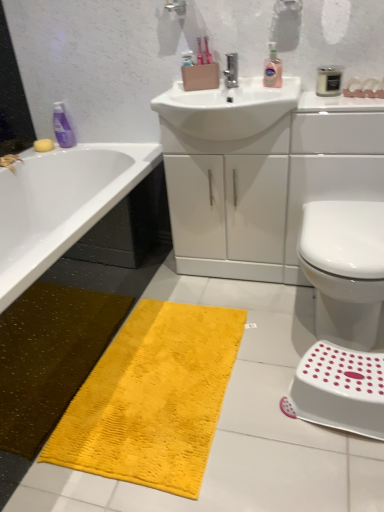
Locate an element on the screen. vacant space situated on the left part of white plastic step stool at lower right is located at coordinates (263, 418).